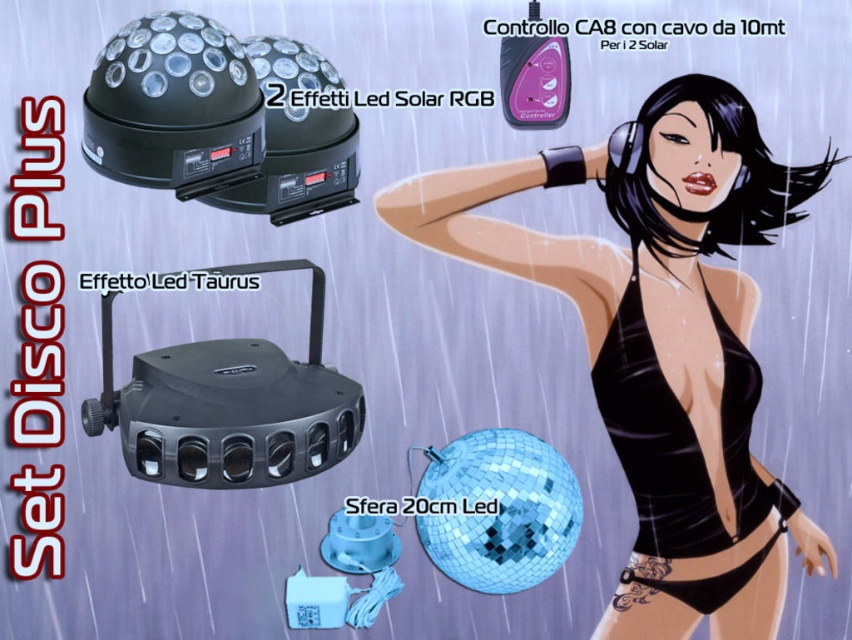
You are a customer looking to purchase the Set Disco Plus. You see the black glossy swimsuit at center and the black plastic effetto led taurus at center in the advertisement. Which item is positioned higher in the image?

The black glossy swimsuit at center is located above the black plastic effetto led taurus at center, so it is positioned higher in the image.

You are a fashion designer looking at the promotional image for the Set Disco Plus. You notice the black glossy swimsuit at center and the shiny blue disco ball at center. Which object is taller in the image?

The black glossy swimsuit at center is taller than the shiny blue disco ball at center according to the description.

You are standing at the point labeled point at (609, 440). There are two objects in the scene. One is 2 Effetti Led Solar RGB in the upper left corner and the other is Effetto Led Taurus below it. How far apart are the 2 Effetti Led Solar RGB and Effetto Led Taurus?

The two objects, 2 Effetti Led Solar RGB and Effetto Led Taurus, are 4.79 feet apart.